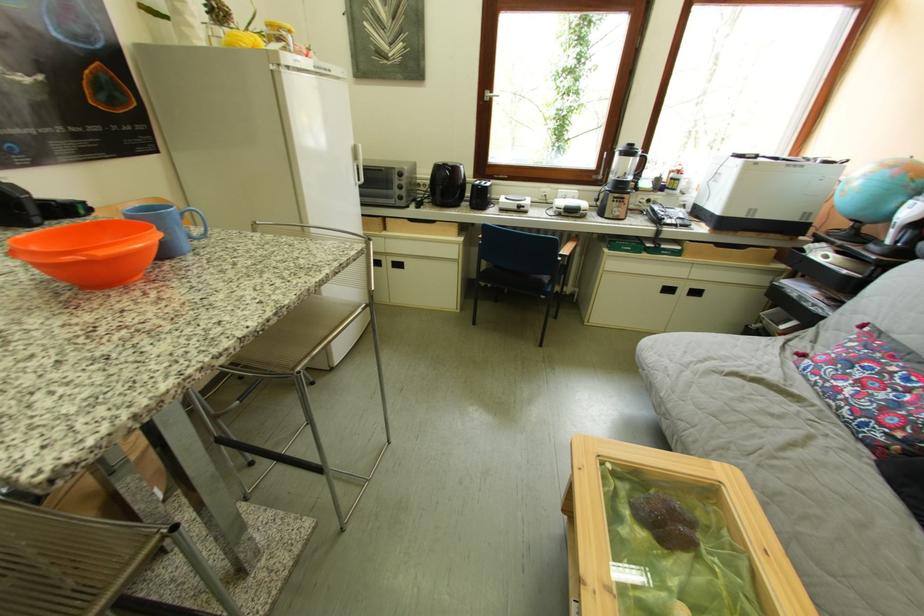
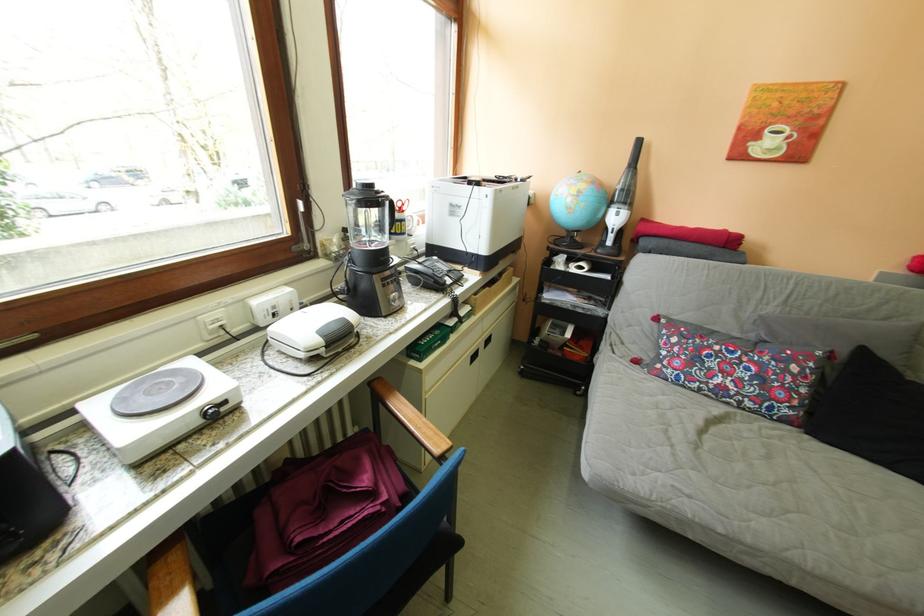
In the second image, find the point that corresponds to [730,379] in the first image.

(713, 455)